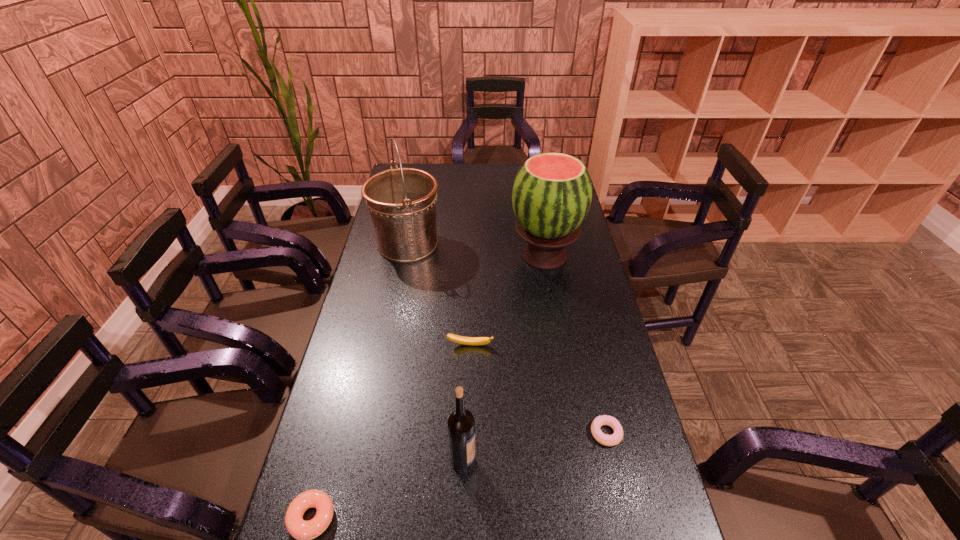
The image size is (960, 540). What are the coordinates of `free space that is in between the watermelon and the bucket` in the screenshot? It's located at (476, 249).

You are a GUI agent. You are given a task and a screenshot of the screen. Output one action in this format:
    pyautogui.click(x=<x>, y=<y>)
    Task: Click on the blank region between the third nearest object and the watermelon
    The image size is (960, 540).
    Given the screenshot: What is the action you would take?
    pyautogui.click(x=575, y=344)

At what (x,y) coordinates should I click in order to perform the action: click on empty space between the watermelon and the banana. Please return your answer as a coordinate pair (x, y). The height and width of the screenshot is (540, 960). Looking at the image, I should click on (507, 300).

Locate an element on the screen. This screenshot has height=540, width=960. free point between the wine bottle and the bucket is located at coordinates (436, 353).

This screenshot has width=960, height=540. In order to click on vacant space that's between the third nearest object and the bucket in this screenshot , I will do `click(507, 339)`.

Image resolution: width=960 pixels, height=540 pixels. I want to click on object that ranks as the fifth closest to the second nearest object, so point(402,201).

Locate which object is the second closest to the watermelon. Please provide its 2D coordinates. Your answer should be formatted as a tuple, i.e. [(x, y)], where the tuple contains the x and y coordinates of a point satisfying the conditions above.

[(458, 339)]

The image size is (960, 540). I want to click on blank space that satisfies the following two spatial constraints: 1. on the front side of the watermelon; 2. on the right side of the bucket, so click(x=406, y=255).

At what (x,y) coordinates should I click in order to perform the action: click on free location that satisfies the following two spatial constraints: 1. at the stem of the banana; 2. on the left side of the shortest object. Please return your answer as a coordinate pair (x, y). The image size is (960, 540). Looking at the image, I should click on (468, 433).

The image size is (960, 540). Identify the location of vacant space that satisfies the following two spatial constraints: 1. at the stem of the shorter doughnut; 2. on the right side of the fourth nearest object. (468, 433).